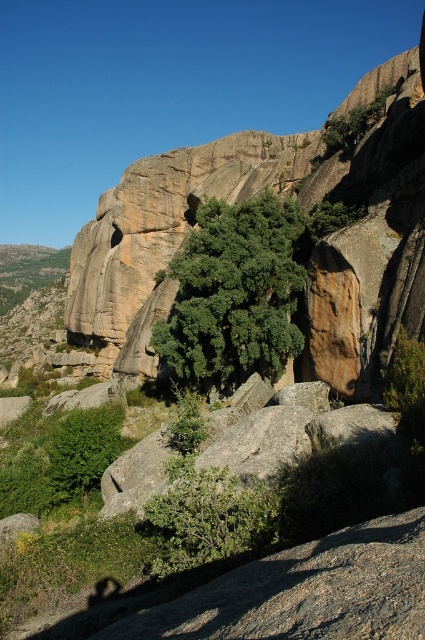
Question: Which point is farther to the camera?

Choices:
 (A) (326, 138)
 (B) (206, 504)
 (C) (229, 364)

Answer: (A)

Question: Which point appears farthest from the camera in this image?

Choices:
 (A) pyautogui.click(x=382, y=112)
 (B) pyautogui.click(x=263, y=518)
 (C) pyautogui.click(x=277, y=291)

Answer: (A)

Question: Which object appears closest to the camera in this image?

Choices:
 (A) green leafy tree at upper center
 (B) green leafy bush at center
 (C) green leafy tree at center

Answer: (B)

Question: Does green leafy tree at center appear on the left side of green leafy tree at upper center?

Choices:
 (A) yes
 (B) no

Answer: (A)

Question: Does green leafy tree at center appear under green leafy tree at upper center?

Choices:
 (A) yes
 (B) no

Answer: (A)

Question: Can you confirm if green leafy tree at center is positioned below green leafy bush at center?

Choices:
 (A) no
 (B) yes

Answer: (A)